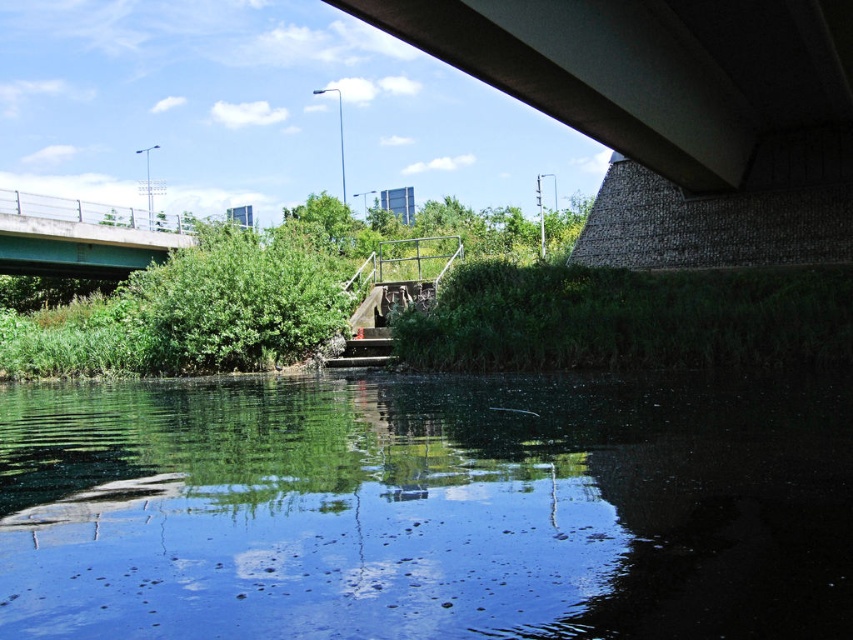
Question: Is the position of clear water at center more distant than that of green painted concrete bridge at upper left?

Choices:
 (A) no
 (B) yes

Answer: (A)

Question: Which point is farther to the camera?

Choices:
 (A) (480, 381)
 (B) (144, 262)

Answer: (B)

Question: Where is clear water at center located in relation to green painted concrete bridge at upper left in the image?

Choices:
 (A) above
 (B) below

Answer: (B)

Question: Which object appears farthest from the camera in this image?

Choices:
 (A) green painted concrete bridge at upper left
 (B) clear water at center

Answer: (A)

Question: Does clear water at center have a greater width compared to green painted concrete bridge at upper left?

Choices:
 (A) yes
 (B) no

Answer: (A)

Question: Which point is closer to the camera taking this photo?

Choices:
 (A) (688, 504)
 (B) (114, 243)

Answer: (A)